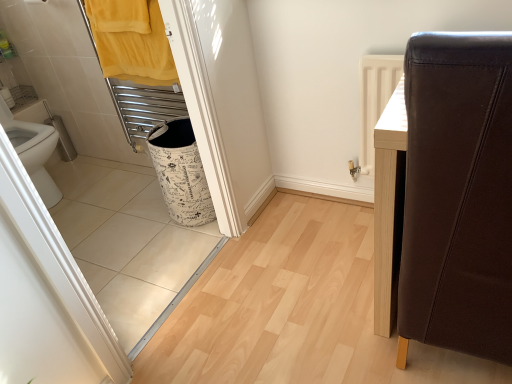
Question: Is point (153, 127) positioned closer to the camera than point (117, 29)?

Choices:
 (A) closer
 (B) farther

Answer: (B)

Question: In terms of size, does white printed fabric laundry basket at lower left appear bigger or smaller than yellow fabric towel at upper left?

Choices:
 (A) big
 (B) small

Answer: (A)

Question: Based on their relative distances, which object is nearer to the brown leather chair at right?

Choices:
 (A) white printed fabric laundry basket at lower left
 (B) yellow fabric towel at upper left

Answer: (A)

Question: Considering the real-world distances, which object is closest to the brown leather chair at right?

Choices:
 (A) white printed fabric laundry basket at lower left
 (B) yellow fabric towel at upper left

Answer: (A)